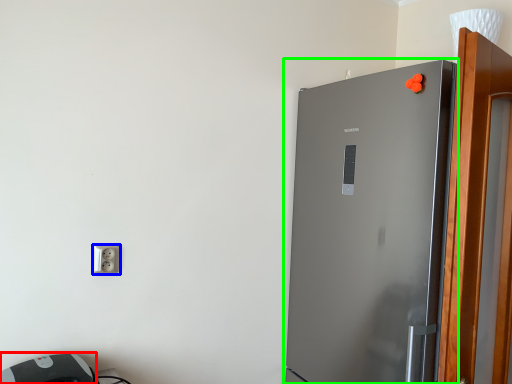
Question: Considering the real-world distances, which object is farthest from appliance (highlighted by a red box)? socket (highlighted by a blue box) or refrigerator (highlighted by a green box)?

Choices:
 (A) socket
 (B) refrigerator

Answer: (B)